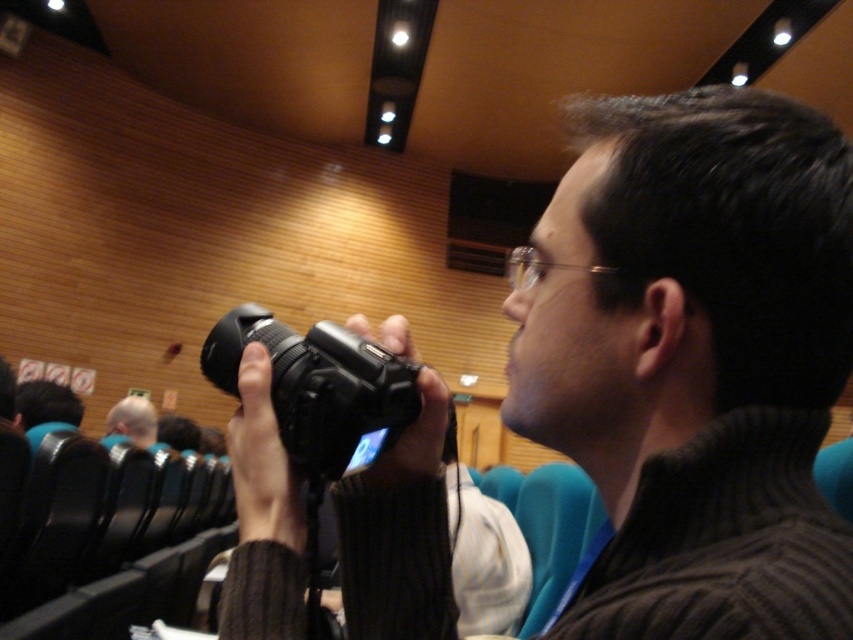
Question: Considering the real-world distances, which object is farthest from the black matte camera at center?

Choices:
 (A) black plastic camera at center
 (B) matte black camera at center
 (C) light blue shirt at center

Answer: (C)

Question: Is black matte camera at center above light blue shirt at center?

Choices:
 (A) no
 (B) yes

Answer: (B)

Question: Estimate the real-world distances between objects in this image. Which object is closer to the matte black camera at center?

Choices:
 (A) black plastic camera at center
 (B) light blue shirt at center

Answer: (B)

Question: Does black plastic camera at center have a smaller size compared to matte black camera at center?

Choices:
 (A) no
 (B) yes

Answer: (B)

Question: Does matte black camera at center have a larger size compared to light blue shirt at center?

Choices:
 (A) no
 (B) yes

Answer: (B)

Question: Which object appears farthest from the camera in this image?

Choices:
 (A) matte black camera at center
 (B) black matte camera at center
 (C) black plastic camera at center
 (D) light blue shirt at center

Answer: (D)